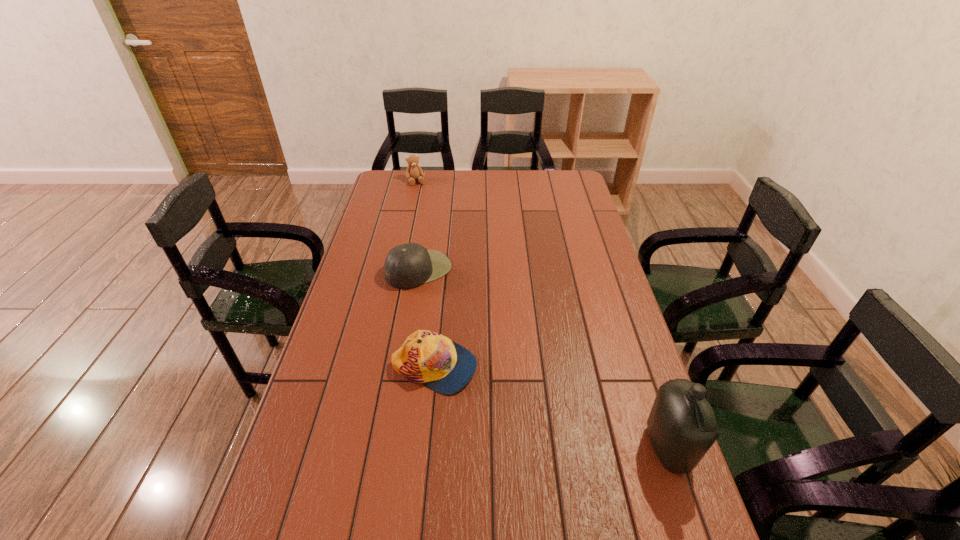
This screenshot has height=540, width=960. I want to click on the nearer cap, so click(432, 359).

You are a GUI agent. You are given a task and a screenshot of the screen. Output one action in this format:
    pyautogui.click(x=<x>, y=<y>)
    Task: Click on the bottle
    The width and height of the screenshot is (960, 540).
    Given the screenshot: What is the action you would take?
    pyautogui.click(x=682, y=427)

I want to click on the rightmost object, so tap(682, 427).

Identify the location of the second farthest object. 407,266.

Find the location of `the farthest object`. the farthest object is located at coordinates 414,171.

Image resolution: width=960 pixels, height=540 pixels. I want to click on free space located on the bill of the nearer cap, so click(x=527, y=367).

At what (x,y) coordinates should I click in order to perform the action: click on vacant space located 0.260m on the left of the tallest object. Please return your answer as a coordinate pair (x, y). Looking at the image, I should click on (539, 448).

The image size is (960, 540). What are the coordinates of `vacant region located 0.090m on the brim of the farther cap` in the screenshot? It's located at (450, 301).

Where is `vacant area situated 0.070m on the brim of the farther cap`? Image resolution: width=960 pixels, height=540 pixels. vacant area situated 0.070m on the brim of the farther cap is located at coordinates (447, 297).

Find the location of a particular element. This screenshot has width=960, height=540. vacant space located 0.200m on the brim of the farther cap is located at coordinates (469, 320).